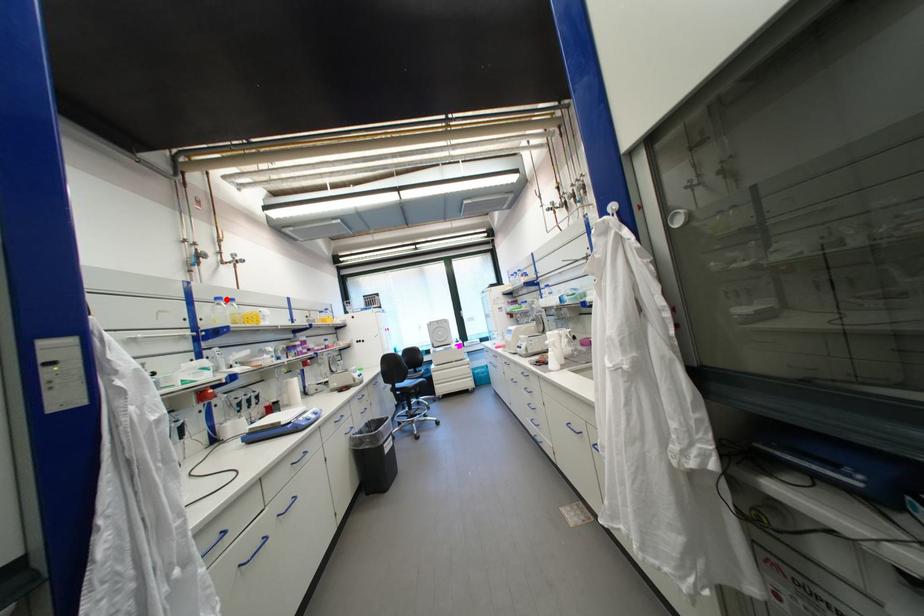
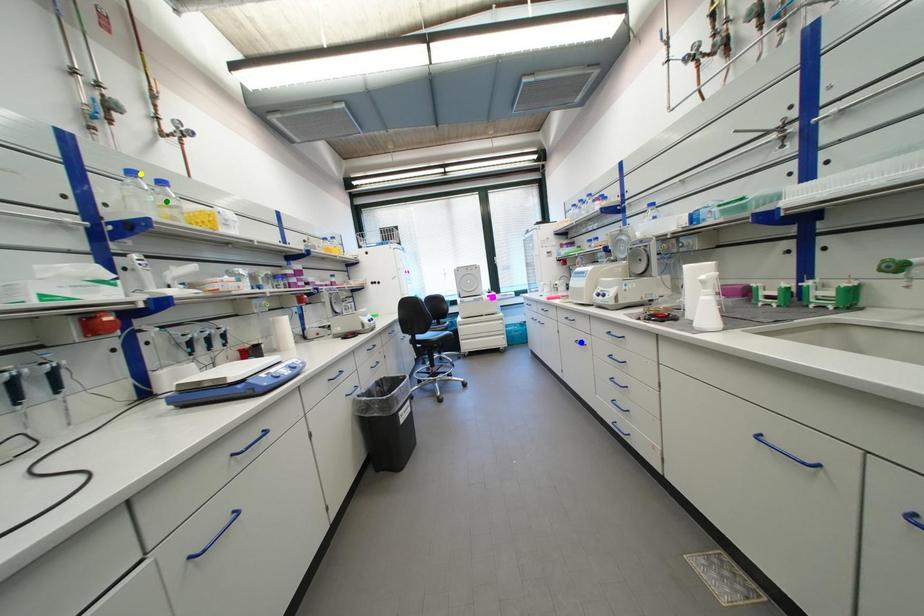
Question: I am providing you with two images of the same scene from different viewpoints. A red point is marked on the first image. You are given multiple points on the second image. Which spot in image 2 lines up with the point in image 1?

Choices:
 (A) yellow point
 (B) blue point
 (C) green point

Answer: (A)